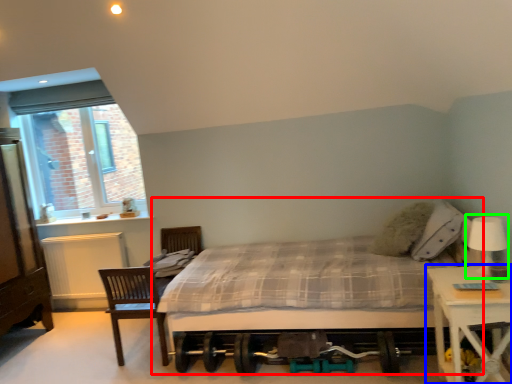
Question: Which object is the closest to the bed (highlighted by a red box)? Choose among these: nightstand (highlighted by a blue box) or table lamp (highlighted by a green box).

Choices:
 (A) nightstand
 (B) table lamp

Answer: (A)